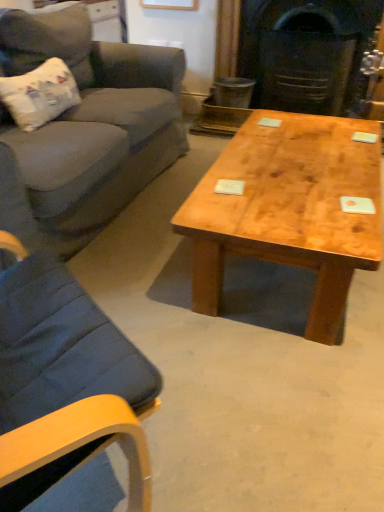
Where is `empty space that is ontop of natural wood coffee table at center (from a real-world perspective)`? Image resolution: width=384 pixels, height=512 pixels. empty space that is ontop of natural wood coffee table at center (from a real-world perspective) is located at coordinates (296, 152).